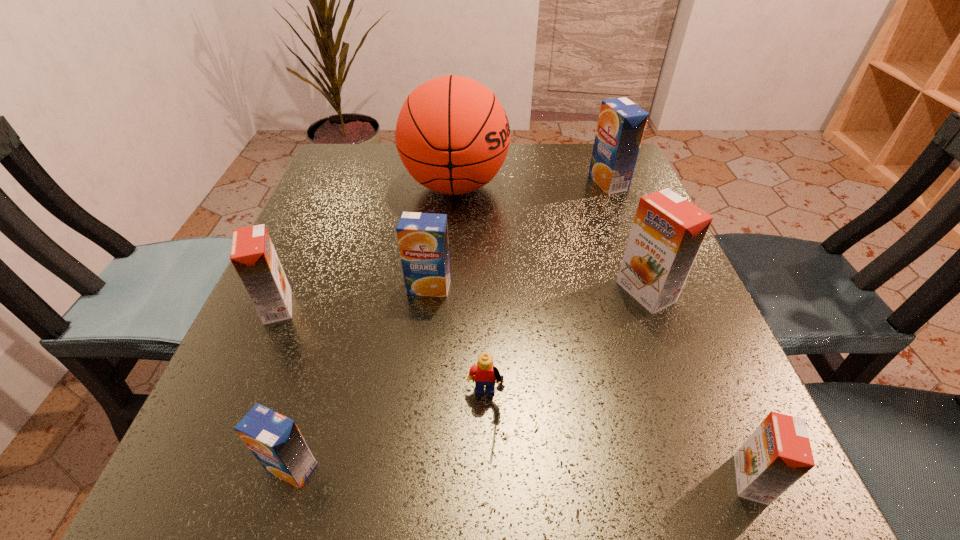
I want to click on basketball, so click(x=452, y=134).

Identify the location of the farthest orange juice. The height and width of the screenshot is (540, 960). (621, 124).

This screenshot has width=960, height=540. In order to click on the biggest blue orange_juice in this screenshot , I will do `click(621, 124)`.

Image resolution: width=960 pixels, height=540 pixels. In order to click on the biggest orange orange juice in this screenshot , I will do `click(667, 233)`.

Image resolution: width=960 pixels, height=540 pixels. In order to click on the leftmost orange juice in this screenshot , I will do `click(253, 255)`.

Find the location of a particular element. the leftmost orange orange juice is located at coordinates (253, 255).

Where is `the second nearest blue orange_juice`? This screenshot has height=540, width=960. the second nearest blue orange_juice is located at coordinates (422, 237).

The image size is (960, 540). What are the coordinates of `the second blue orange_juice from left to right` in the screenshot? It's located at (422, 237).

Where is `yellow Lego`? This screenshot has height=540, width=960. yellow Lego is located at coordinates (484, 373).

The width and height of the screenshot is (960, 540). Find the location of `the third nearest object`. the third nearest object is located at coordinates (484, 373).